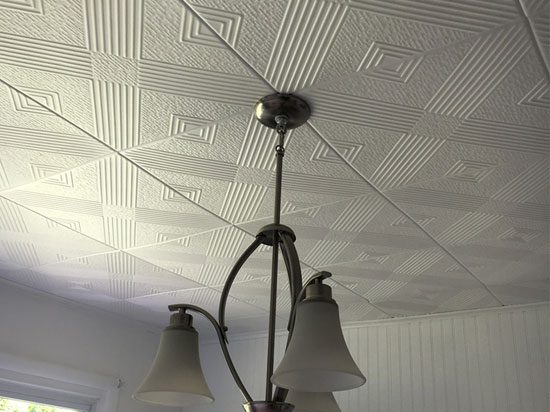
The image size is (550, 412). I want to click on rod, so click(270, 320).